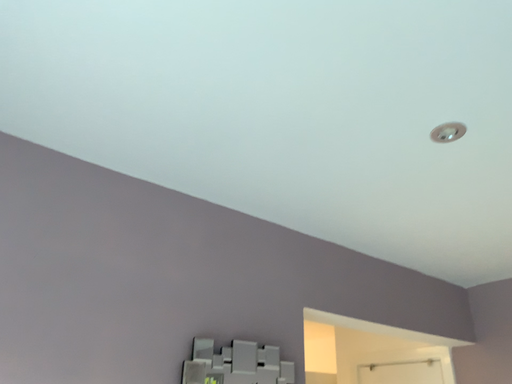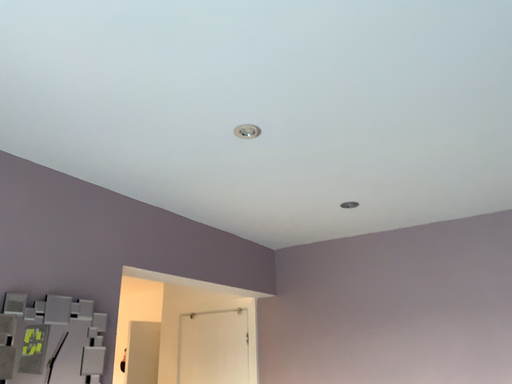
Question: Which way did the camera rotate in the video?

Choices:
 (A) rotated upward
 (B) rotated downward

Answer: (B)